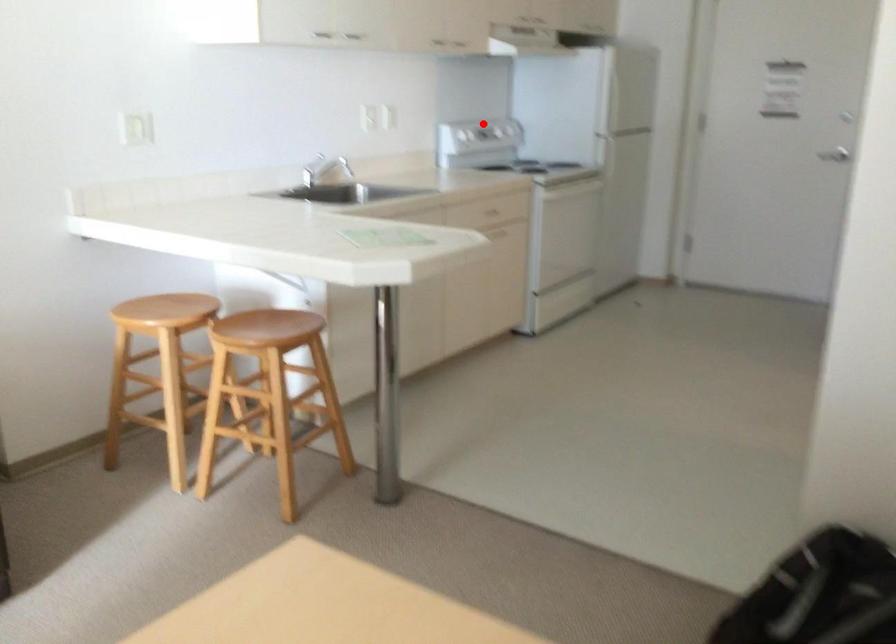
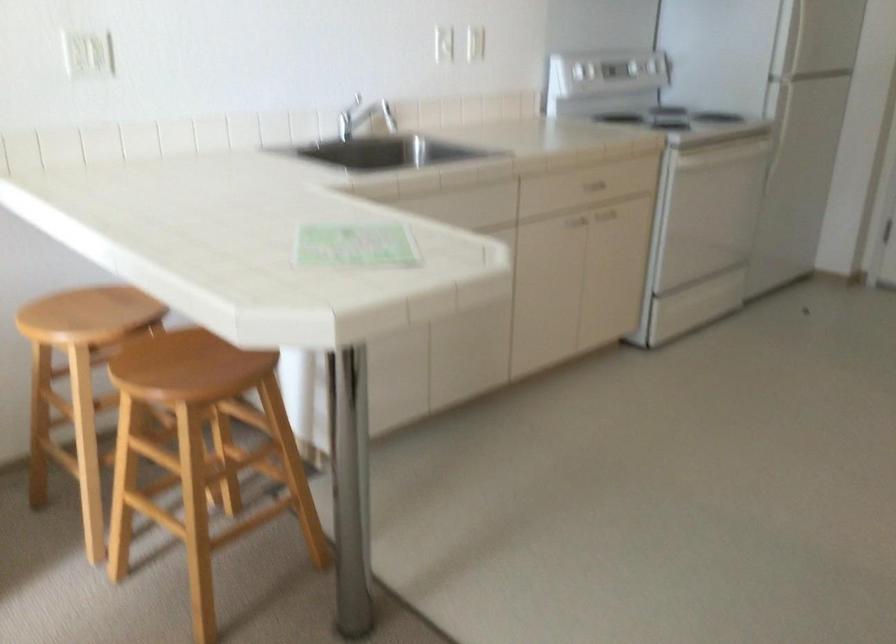
Find the pixel in the second image that matches the highlighted location in the first image.

(609, 71)